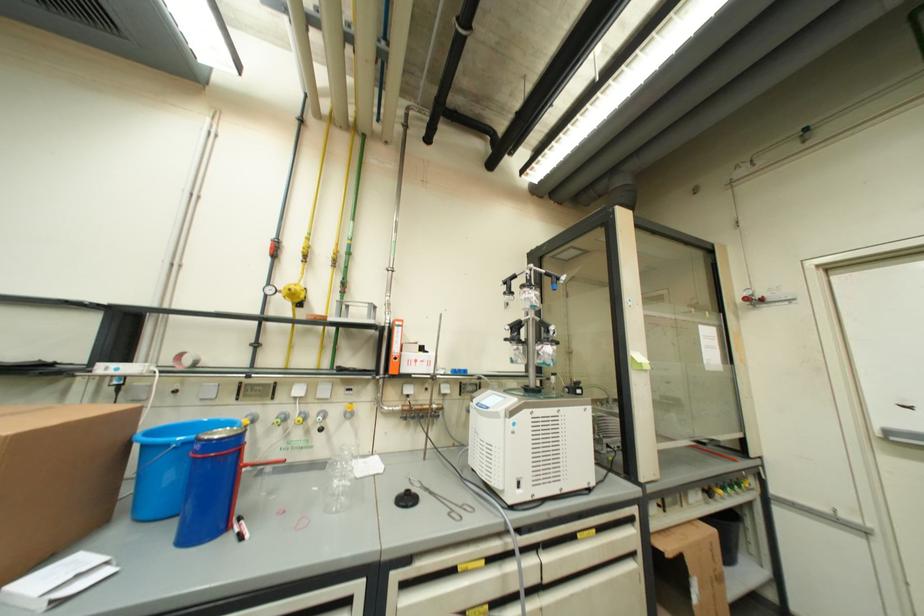
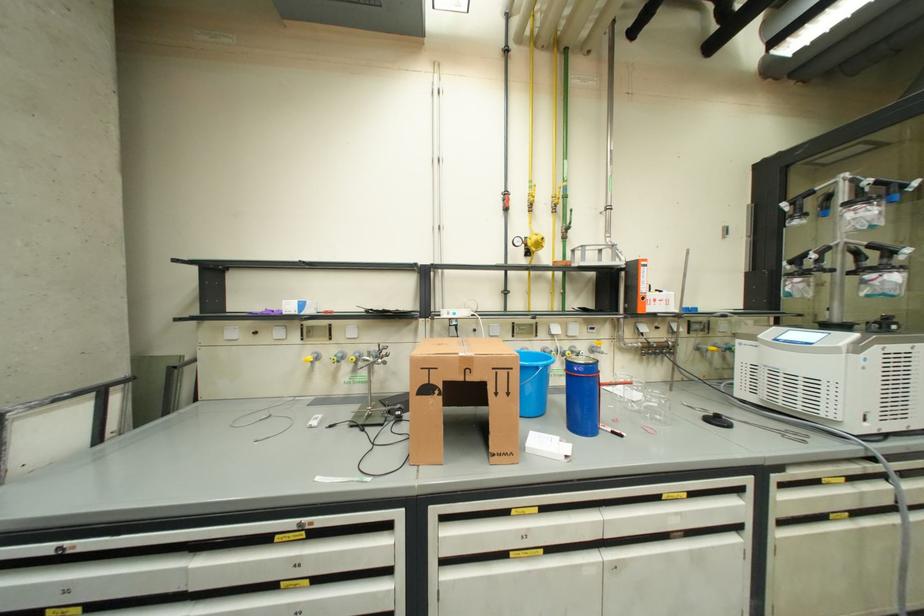
Question: In a continuous first-person perspective shot, in which direction is the camera moving?

Choices:
 (A) Left
 (B) Right
 (C) Forward
 (D) Backward

Answer: (A)